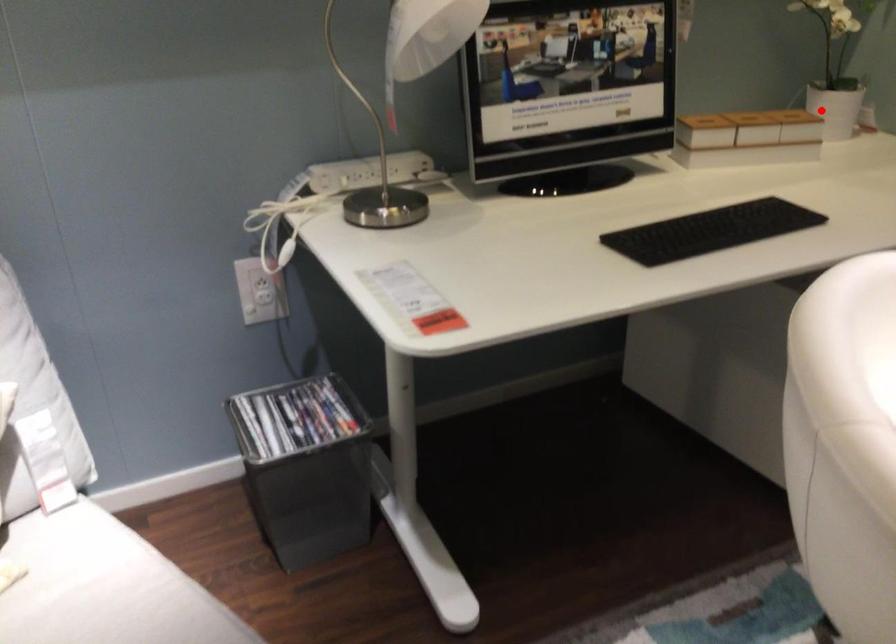
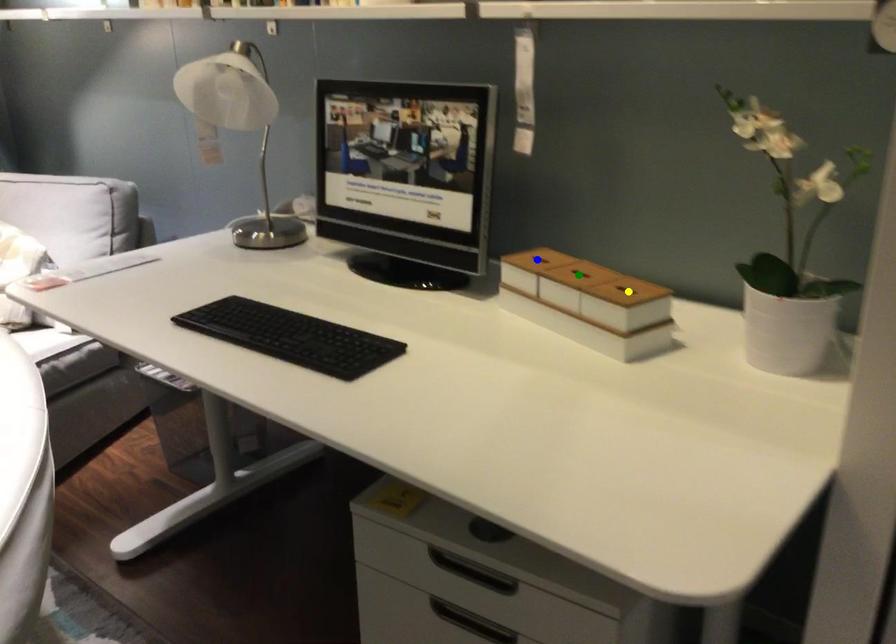
Question: I am providing you with two images of the same scene from different viewpoints. A red point is marked on the first image. You are given multiple points on the second image. Which point in image 2 represents the same 3d spot as the red point in image 1?

Choices:
 (A) blue point
 (B) yellow point
 (C) green point

Answer: (B)